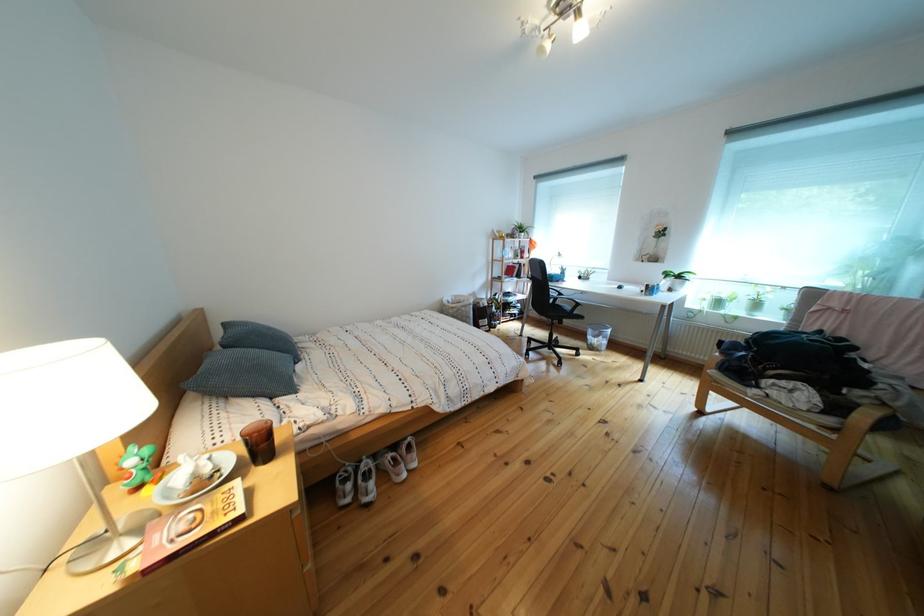
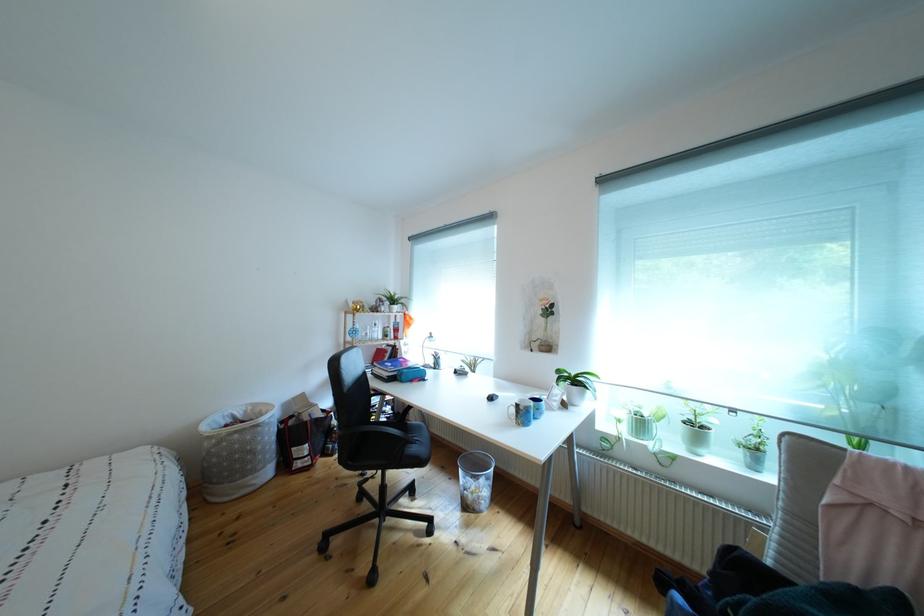
Where in the second image is the point corresponding to (480,323) from the first image?

(263, 456)